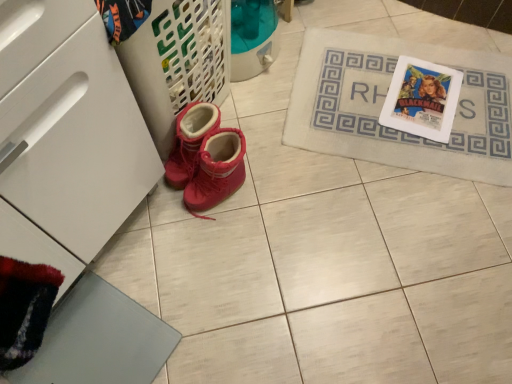
The width and height of the screenshot is (512, 384). I want to click on suede-like red boots at lower left, so click(205, 158).

From a real-world perspective, is white matte drawer at lower left physically above beige fabric bath mat at upper right?

Yes, from a real-world perspective, white matte drawer at lower left is over beige fabric bath mat at upper right

Is white matte drawer at lower left located outside beige fabric bath mat at upper right?

Yes, white matte drawer at lower left is not within beige fabric bath mat at upper right.

Identify the location of bath mat behind the white matte drawer at lower left. click(x=384, y=100).

How distant is beige fabric bath mat at upper right from suede-like red boots at lower left?

They are 17.04 inches apart.

Could you tell me if beige fabric bath mat at upper right is facing suede-like red boots at lower left?

No, beige fabric bath mat at upper right is not aimed at suede-like red boots at lower left.

Locate an element on the screen. This screenshot has width=512, height=384. bath mat that appears above the suede-like red boots at lower left (from the image's perspective) is located at coordinates (384, 100).

From a real-world perspective, is beige fabric bath mat at upper right positioned under suede-like red boots at lower left based on gravity?

Yes, from a real-world perspective, beige fabric bath mat at upper right is below suede-like red boots at lower left.

In terms of height, does suede-like red boots at lower left look taller or shorter compared to beige fabric bath mat at upper right?

suede-like red boots at lower left is taller than beige fabric bath mat at upper right.

From a real-world perspective, is suede-like red boots at lower left over beige fabric bath mat at upper right?

Yes, from a real-world perspective, suede-like red boots at lower left is over beige fabric bath mat at upper right

Which is more to the left, suede-like red boots at lower left or beige fabric bath mat at upper right?

suede-like red boots at lower left.

Considering the sizes of objects suede-like red boots at lower left and beige fabric bath mat at upper right in the image provided, who is thinner, suede-like red boots at lower left or beige fabric bath mat at upper right?

suede-like red boots at lower left is thinner.

Can you confirm if suede-like red boots at lower left is wider than white matte drawer at lower left?

No.

Is suede-like red boots at lower left aimed at white matte drawer at lower left?

No, suede-like red boots at lower left is not aimed at white matte drawer at lower left.

From the picture: Considering the relative positions of suede-like red boots at lower left and white matte drawer at lower left in the image provided, is suede-like red boots at lower left to the right of white matte drawer at lower left from the viewer's perspective?

Yes, suede-like red boots at lower left is to the right of white matte drawer at lower left.

Which is closer, (207, 190) or (83, 160)?

The point (83, 160) is in front.

Where is `drawer that appears on the left of beige fabric bath mat at upper right`? This screenshot has width=512, height=384. drawer that appears on the left of beige fabric bath mat at upper right is located at coordinates (76, 143).

How many degrees apart are the facing directions of beige fabric bath mat at upper right and white matte drawer at lower left?

The facing directions of beige fabric bath mat at upper right and white matte drawer at lower left are 69 degrees apart.

Considering the relative sizes of beige fabric bath mat at upper right and white matte drawer at lower left in the image provided, is beige fabric bath mat at upper right thinner than white matte drawer at lower left?

No.

Considering the relative sizes of white matte drawer at lower left and suede-like red boots at lower left in the image provided, is white matte drawer at lower left smaller than suede-like red boots at lower left?

Actually, white matte drawer at lower left might be larger than suede-like red boots at lower left.

Which is closer, (102, 236) or (229, 158)?

Point (102, 236).

Is white matte drawer at lower left at the right side of suede-like red boots at lower left?

No, white matte drawer at lower left is not to the right of suede-like red boots at lower left.

From the image's perspective, does white matte drawer at lower left appear lower than suede-like red boots at lower left?

Yes, from the image's perspective, white matte drawer at lower left is below suede-like red boots at lower left.

This screenshot has width=512, height=384. Find the location of `bath mat that appears on the right of white matte drawer at lower left`. bath mat that appears on the right of white matte drawer at lower left is located at coordinates (384, 100).

You are a GUI agent. You are given a task and a screenshot of the screen. Output one action in this format:
    pyautogui.click(x=<x>, y=<y>)
    Task: Click on the bath mat that is above the suede-like red boots at lower left (from the image's perspective)
    
    Given the screenshot: What is the action you would take?
    pyautogui.click(x=384, y=100)

Looking at the image, which one is located closer to suede-like red boots at lower left, white matte drawer at lower left or beige fabric bath mat at upper right?

The object closer to suede-like red boots at lower left is white matte drawer at lower left.

Consider the image. When comparing their distances from beige fabric bath mat at upper right, does suede-like red boots at lower left or white matte drawer at lower left seem closer?

suede-like red boots at lower left is closer to beige fabric bath mat at upper right.

Which object lies nearer to the anchor point white matte drawer at lower left, beige fabric bath mat at upper right or suede-like red boots at lower left?

suede-like red boots at lower left is positioned closer to the anchor white matte drawer at lower left.

Looking at the image, which one is located closer to white matte drawer at lower left, suede-like red boots at lower left or beige fabric bath mat at upper right?

suede-like red boots at lower left lies closer to white matte drawer at lower left than the other object.

Considering their positions, is beige fabric bath mat at upper right positioned further to suede-like red boots at lower left than white matte drawer at lower left?

beige fabric bath mat at upper right lies further to suede-like red boots at lower left than the other object.

From the image, which object appears to be farther from beige fabric bath mat at upper right, white matte drawer at lower left or suede-like red boots at lower left?

white matte drawer at lower left is positioned further to the anchor beige fabric bath mat at upper right.

Locate an element on the screen. Image resolution: width=512 pixels, height=384 pixels. footwear between white matte drawer at lower left and beige fabric bath mat at upper right in the horizontal direction is located at coordinates [205, 158].